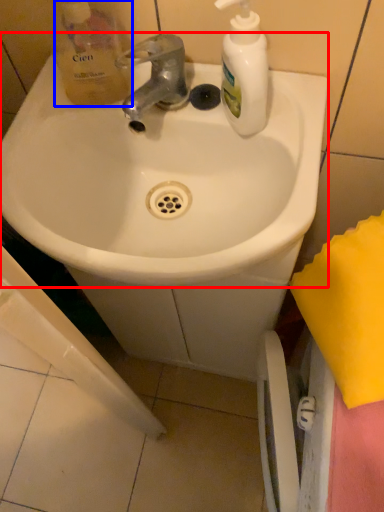
Question: Which of the following is the closest to the observer, sink (highlighted by a red box) or product (highlighted by a blue box)?

Choices:
 (A) sink
 (B) product

Answer: (A)